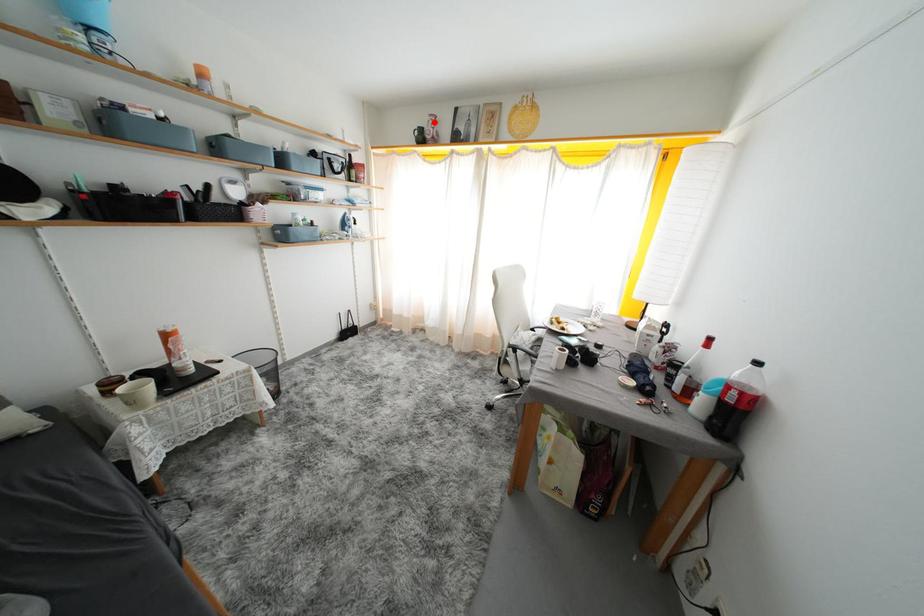
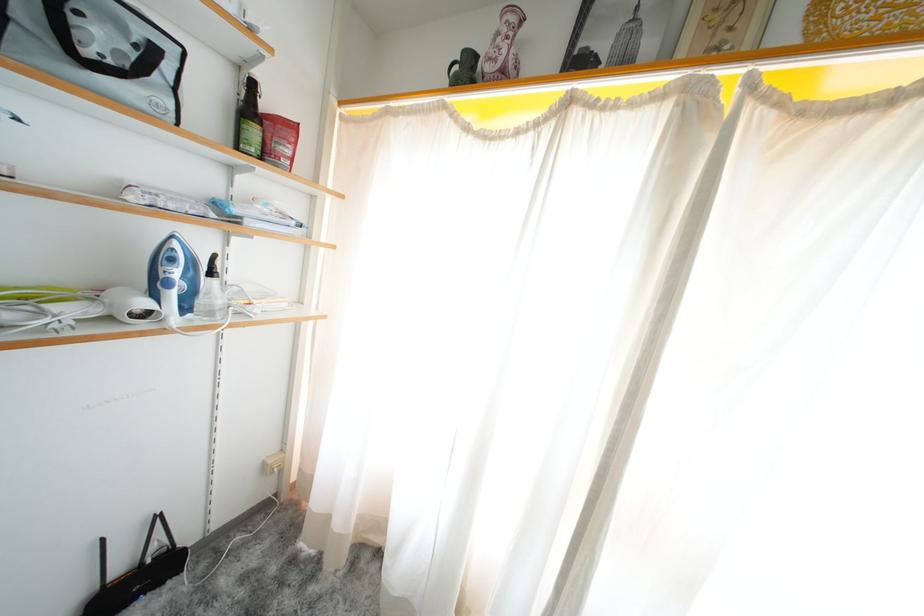
Question: I am providing you with two images of the same scene from different viewpoints. Given a red point in image1, look at the same physical point in image2. Is it:

Choices:
 (A) Closer to the viewpoint
 (B) Farther from the viewpoint

Answer: (B)